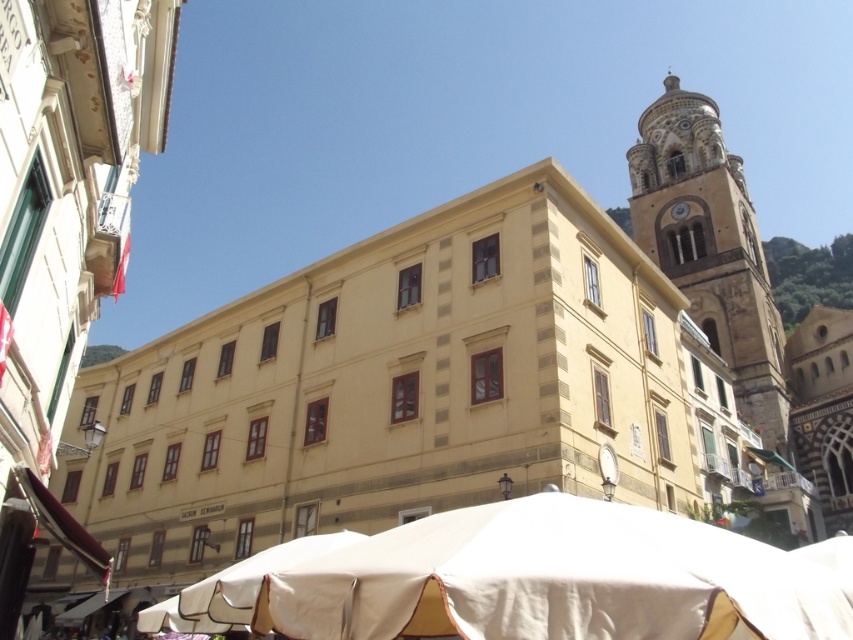
You are a city planner assessing the distance between the white fabric canopy at lower center and the golden stone bell tower at upper right for a new pedestrian walkway. Given that the minimum required distance for safety is 100 meters, will the proposed walkway between these two structures meet the safety standards?

The white fabric canopy at lower center is 93.55 meters from the golden stone bell tower at upper right. Since the required distance is 100 meters, the proposed walkway does not meet the safety standards as it is 6.45 meters short.

You are standing in the urban scene and want to take a photo of the white fabric canopy at lower center and the golden stone bell tower at upper right. Which object should you focus on first to ensure both are in the frame?

You should focus on the white fabric canopy at lower center first since it is closer to the viewer, ensuring both it and the golden stone bell tower at upper right remain in the frame.

You are an architect assessing the scale of elements in the urban scene. Given the white fabric canopy at lower center and the golden stone bell tower at upper right, which object appears larger in the image?

The golden stone bell tower at upper right appears larger than the white fabric canopy at lower center.